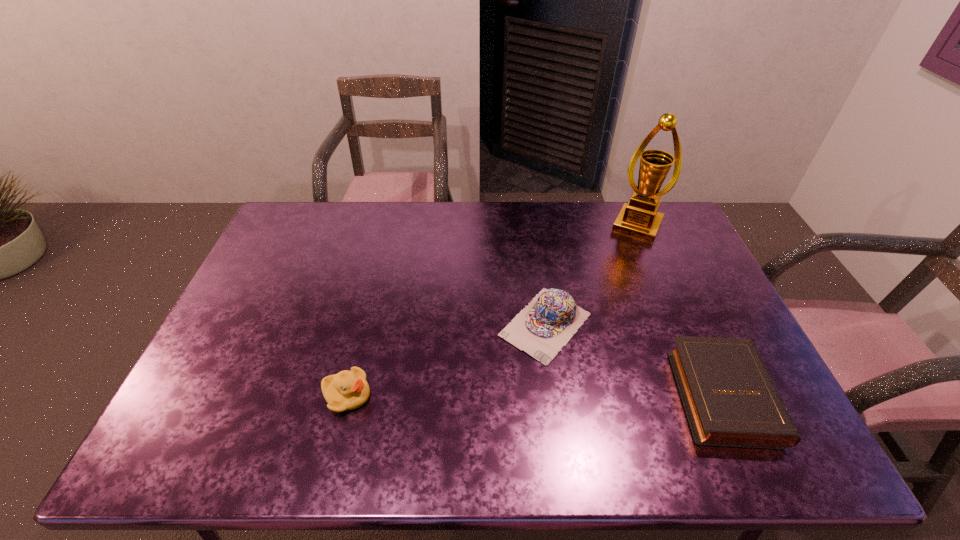
Where is `object that is at the far edge`? object that is at the far edge is located at coordinates (640, 219).

Locate an element on the screen. duckling at the near edge is located at coordinates (347, 390).

At what (x,y) coordinates should I click in order to perform the action: click on Bible at the near edge. Please return your answer as a coordinate pair (x, y). This screenshot has width=960, height=540. Looking at the image, I should click on (730, 399).

The width and height of the screenshot is (960, 540). Identify the location of Bible that is at the right edge. (730, 399).

Image resolution: width=960 pixels, height=540 pixels. What are the coordinates of `award positioned at the right edge` in the screenshot? It's located at (640, 219).

The height and width of the screenshot is (540, 960). In order to click on object that is positioned at the far right corner in this screenshot , I will do `click(640, 219)`.

I want to click on object present at the near right corner, so point(730,399).

Where is `free location at the far edge`? free location at the far edge is located at coordinates (333, 219).

Where is `free space at the near edge of the desktop`? The width and height of the screenshot is (960, 540). free space at the near edge of the desktop is located at coordinates (384, 416).

I want to click on blank space at the left edge of the desktop, so click(235, 384).